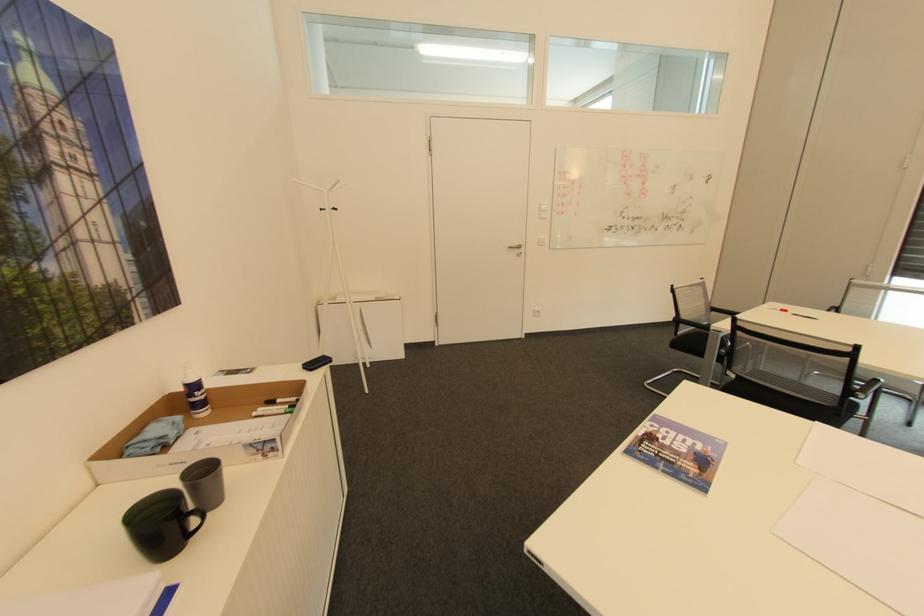
This screenshot has height=616, width=924. What do you see at coordinates (336, 256) in the screenshot?
I see `a coat rack hook` at bounding box center [336, 256].